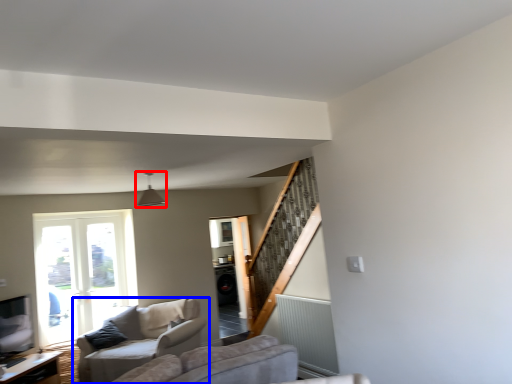
Question: Which object is closer to the camera taking this photo, light fixture (highlighted by a red box) or studio couch (highlighted by a blue box)?

Choices:
 (A) light fixture
 (B) studio couch

Answer: (A)